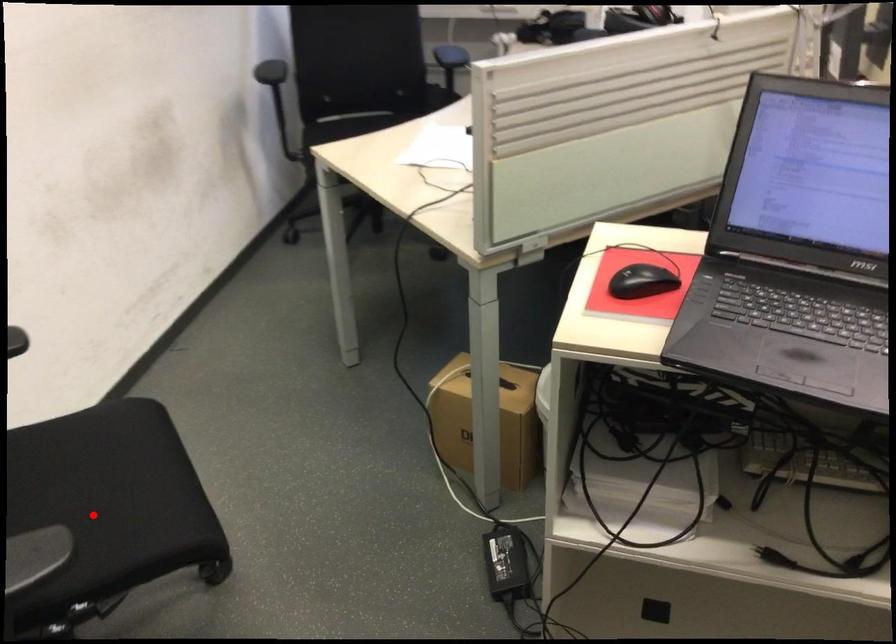
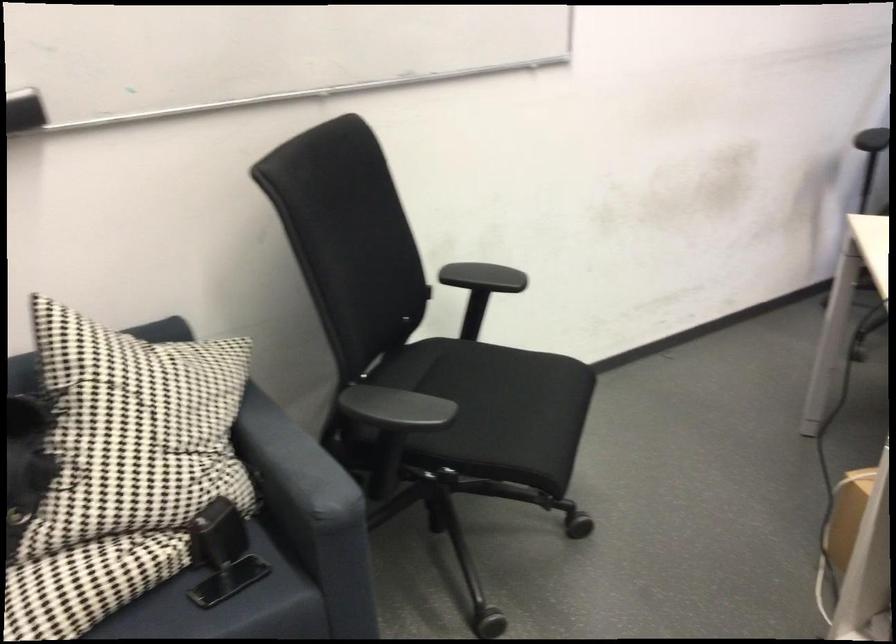
Question: I am providing you with two images of the same scene from different viewpoints. A red point is shown in image1. For the corresponding object point in image2, is it positioned nearer or farther from the camera?

Choices:
 (A) Nearer
 (B) Farther

Answer: (B)